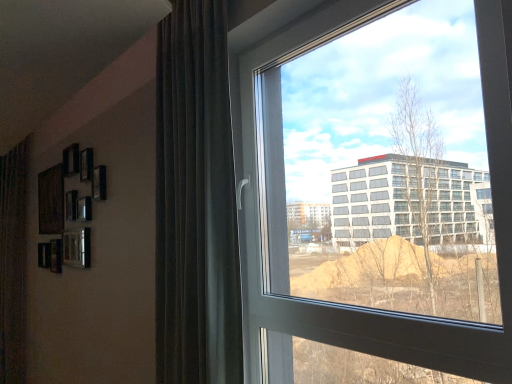
Question: In terms of size, does dark brown velvet curtain at left appear bigger or smaller than transparent glass window at center?

Choices:
 (A) big
 (B) small

Answer: (A)

Question: Is dark brown velvet curtain at left inside the boundaries of transparent glass window at center, or outside?

Choices:
 (A) outside
 (B) inside

Answer: (A)

Question: Is dark brown velvet curtain at left in front of or behind transparent glass window at center in the image?

Choices:
 (A) front
 (B) behind

Answer: (B)

Question: From the image's perspective, is transparent glass window at center located above or below dark brown velvet curtain at left?

Choices:
 (A) above
 (B) below

Answer: (B)

Question: From a real-world perspective, relative to dark brown velvet curtain at left, is transparent glass window at center vertically above or below?

Choices:
 (A) above
 (B) below

Answer: (B)

Question: In terms of height, does transparent glass window at center look taller or shorter compared to dark brown velvet curtain at left?

Choices:
 (A) tall
 (B) short

Answer: (B)

Question: Based on their sizes in the image, would you say transparent glass window at center is bigger or smaller than dark brown velvet curtain at left?

Choices:
 (A) big
 (B) small

Answer: (B)